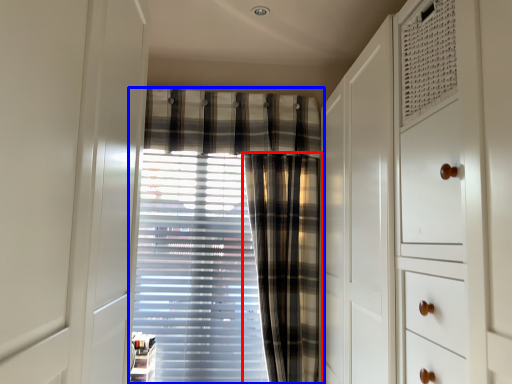
Question: Which object appears closest to the camera in this image, curtain (highlighted by a red box) or curtain (highlighted by a blue box)?

Choices:
 (A) curtain
 (B) curtain

Answer: (A)